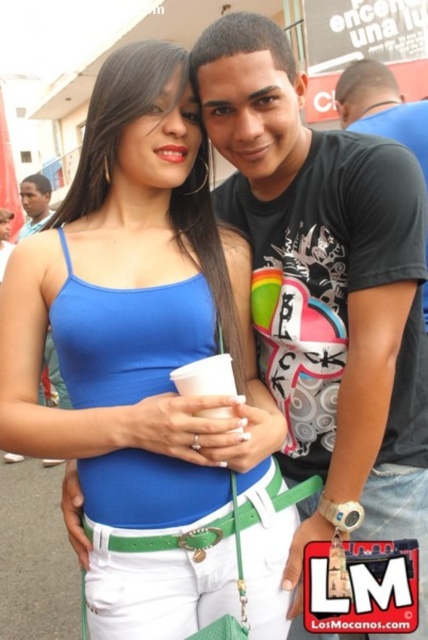
You are a photographer trying to focus on the matte blue tank top at center and the matte black headband at upper left. Which object should you adjust your camera focus on first to ensure both are in focus?

You should focus on the matte blue tank top at center first because it is closer to the viewer than the matte black headband at upper left, so adjusting focus starting from the closer object ensures both will be in focus.